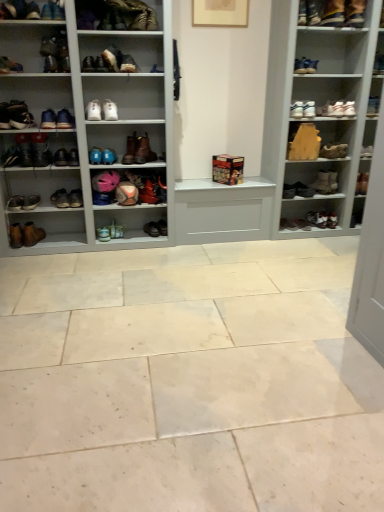
At what (x,y) coordinates should I click in order to perform the action: click on free space in front of white glossy shoe rack at center, acting as the second shelf starting from the right. Please return your answer as a coordinate pair (x, y). This screenshot has width=384, height=512. Looking at the image, I should click on (193, 337).